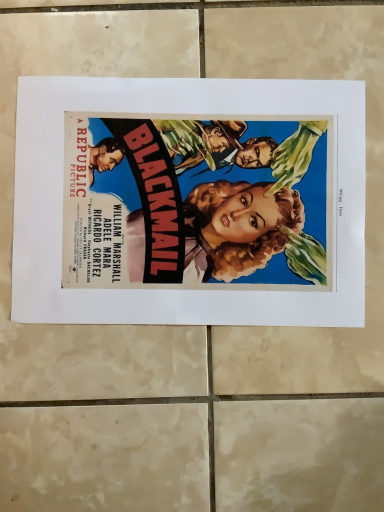
Locate an element on the screen. vacant region above matte paper poster at center (from a real-world perspective) is located at coordinates (199, 198).